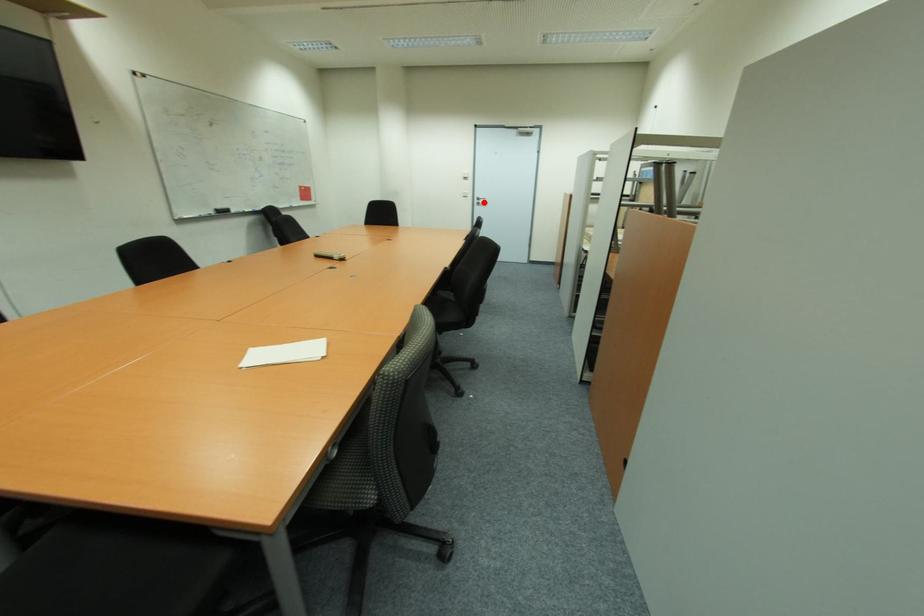
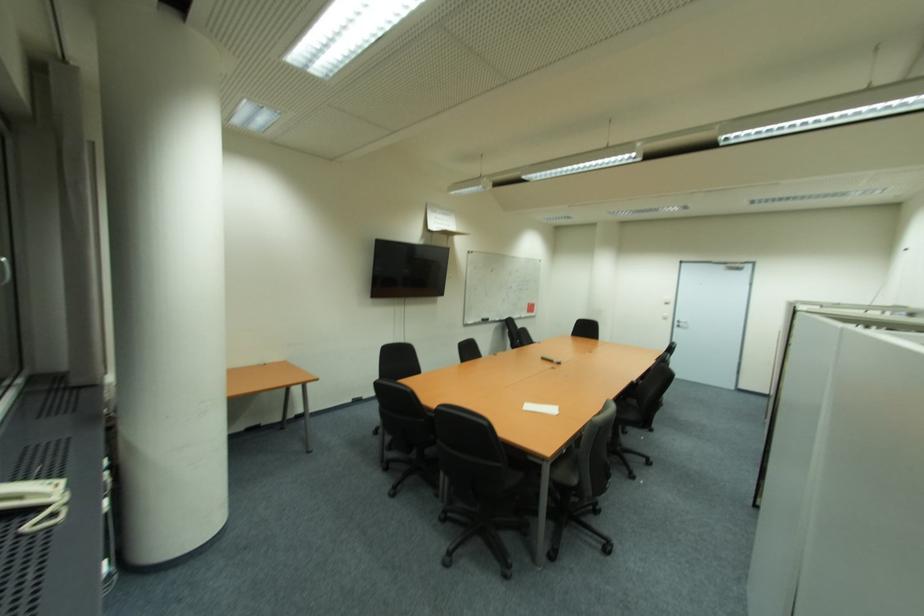
Question: I am providing you with two images of the same scene from different viewpoints. In image1, a red point is highlighted. Considering the same 3D point in image2, which of the following is correct?

Choices:
 (A) It is closer
 (B) It is farther

Answer: (B)